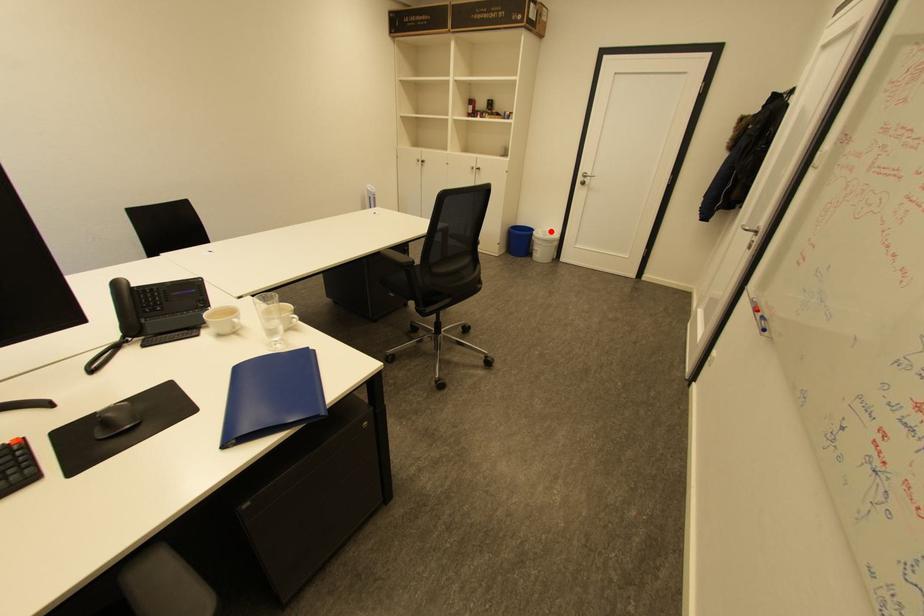
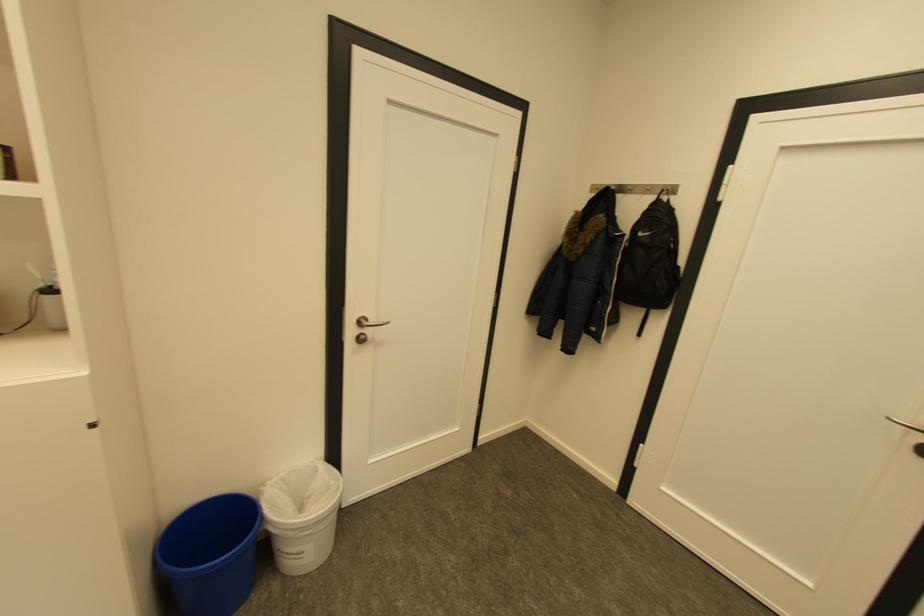
Find the pixel in the second image that matches the highlighted location in the first image.

(289, 477)